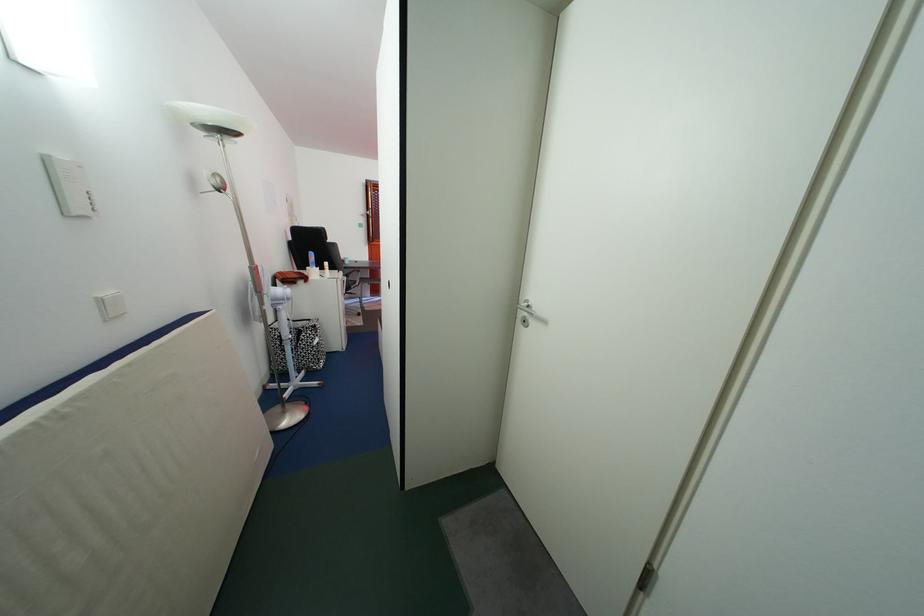
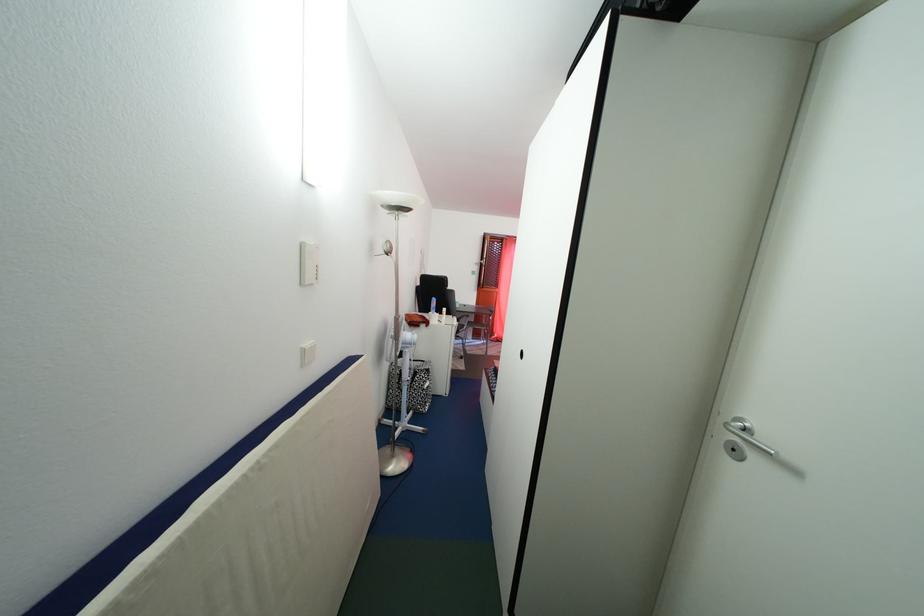
Which direction would the cameraman need to move to produce the second image?

The cameraman walked toward left, forward.